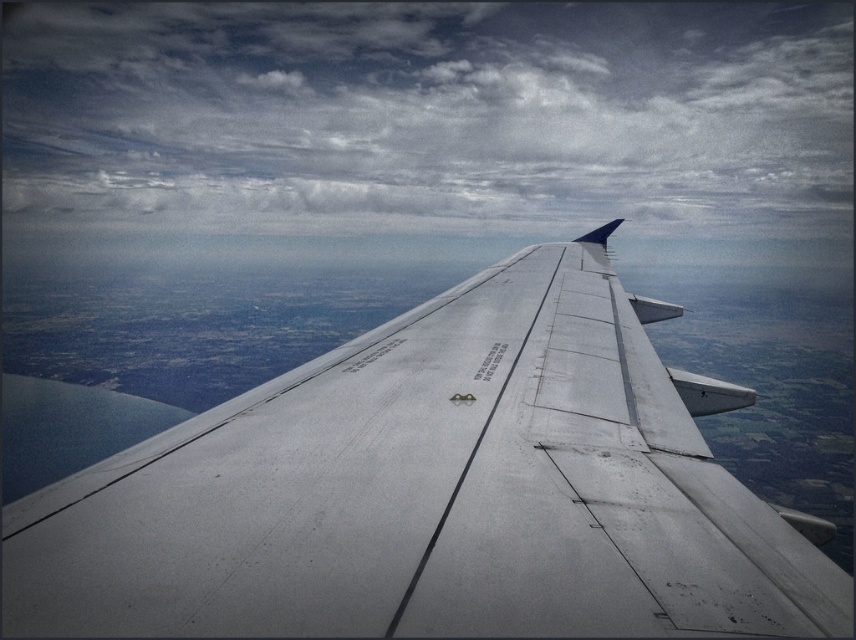
You are a passenger sitting in an airplane seat and looking out the window. You notice a point marked at coordinates (437, 492). Based on your view from the seat, what object does this point most likely correspond to?

The point at coordinates (437, 492) corresponds to the metallic gray wing at center.

You are a passenger sitting near the window on an airplane. You notice the metallic gray wing at center and the cloudy sky at upper center outside. Which object is closer to you from your seat?

The metallic gray wing at center is closer to you than the cloudy sky at upper center because it is positioned below the cloudy sky at upper center in the scene.